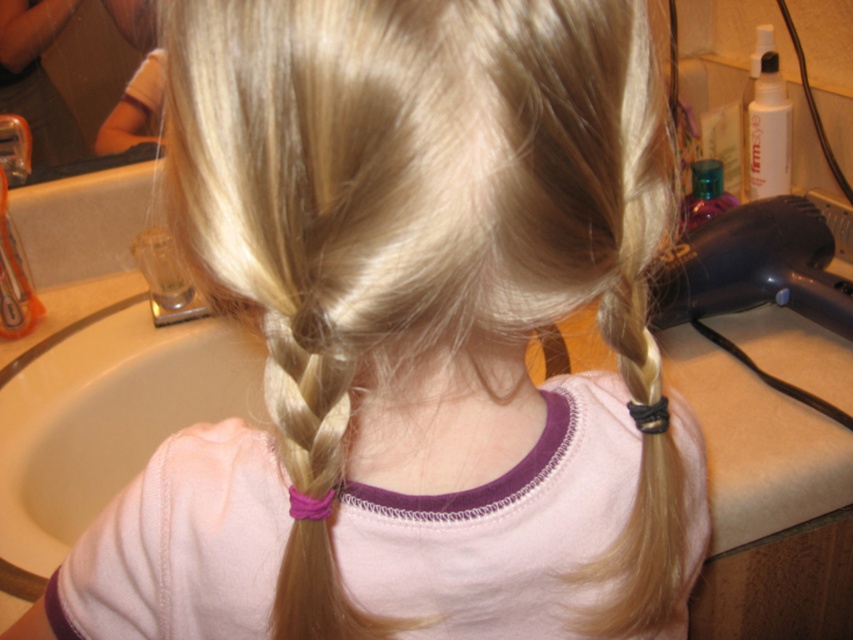
You are standing in the bathroom and need to reach the black plastic hair dryer at right to dry your hair. Based on its 2D coordinates, is it closer to the sink or the mirror?

The black plastic hair dryer at right is located at point (753, 266). Without specific coordinate references for the sink and mirror, it is impossible to determine its proximity to either based solely on the given information.

You are standing in a bathroom and want to dry your hair using the black plastic hair dryer at right. The coordinates of the hair dryer are given as point (753, 266). If you are currently at the origin point 0,0, which direction should you move to reach the hair dryer?

The black plastic hair dryer at right is located at coordinates (753, 266). Since the x and y coordinates are both positive, you should move towards the right and upwards to reach it.

You are in a bathroom and need to dry your hair quickly. You see the black plastic hair dryer at right and the brushed metal faucet at upper left. Which object should you use to dry your hair?

The black plastic hair dryer at right is the correct tool to dry your hair, as it is designed for that purpose. The brushed metal faucet at upper left is for water, not drying hair.